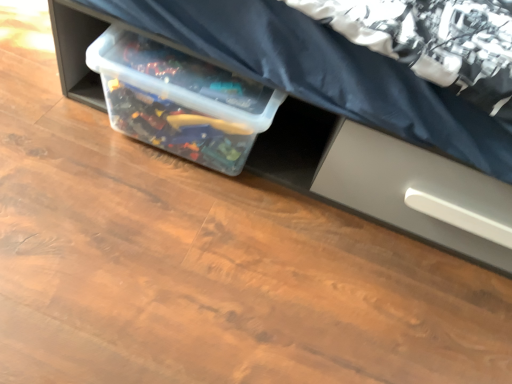
You are a GUI agent. You are given a task and a screenshot of the screen. Output one action in this format:
    pyautogui.click(x=<x>, y=<y>)
    Task: Click on the free space on the front side of satin gray drawer at lower right
    This screenshot has height=384, width=512.
    Given the screenshot: What is the action you would take?
    pyautogui.click(x=381, y=301)